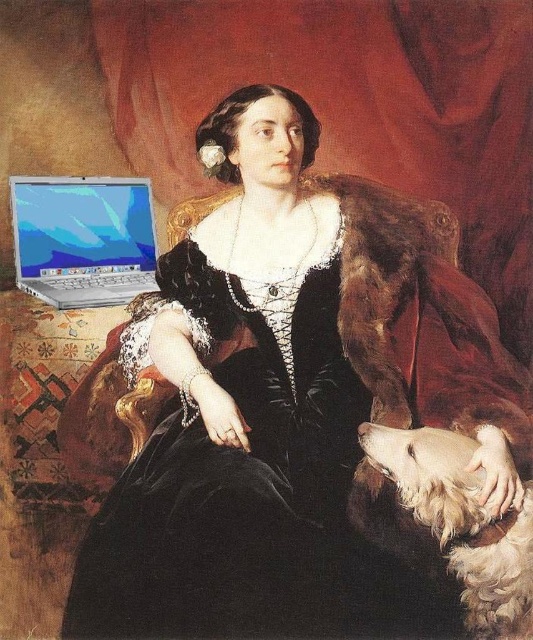
You are an art student analyzing the composition of the painting. You need to determine the exact coordinates of the black velvet dress at center. What are its coordinates?

The coordinates of the black velvet dress at center are at point (236,477).

You are an interior designer who needs to place a new sofa in the room. The sofa is 1.2 meters wide. You see the white fluffy dog at lower right and the silver metallic laptop at lower left. Which object should you avoid placing the sofa next to to ensure there is enough space?

The white fluffy dog at lower right has a lesser width compared to the silver metallic laptop at lower left. Therefore, placing the sofa next to the silver metallic laptop at lower left may not leave enough space due to its larger width, so you should avoid placing the sofa next to the silver metallic laptop at lower left.